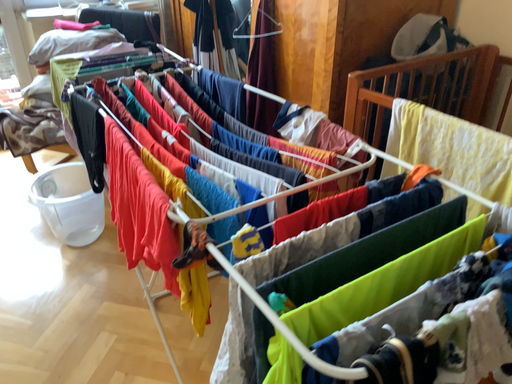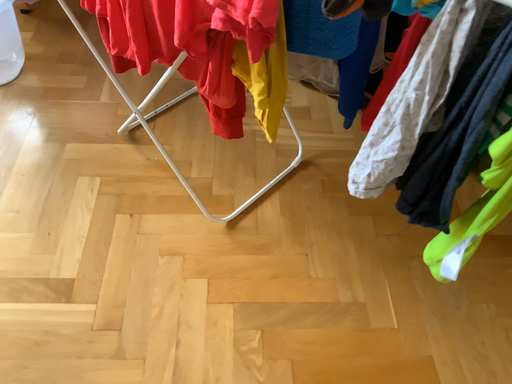
Question: How did the camera likely rotate when shooting the video?

Choices:
 (A) rotated upward
 (B) rotated downward

Answer: (B)